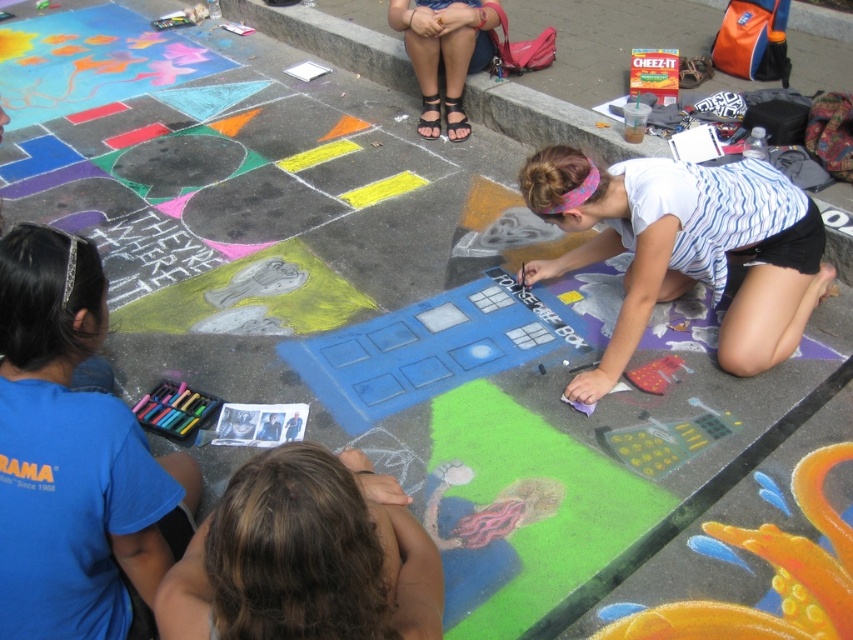
Does blue fabric shirt at lower left have a greater width compared to brown hair at lower left?

Incorrect, blue fabric shirt at lower left's width does not surpass brown hair at lower left's.

Does blue fabric shirt at lower left have a smaller size compared to brown hair at lower left?

No, blue fabric shirt at lower left is not smaller than brown hair at lower left.

Find the location of a particular element. This screenshot has width=853, height=640. blue fabric shirt at lower left is located at coordinates (73, 456).

Can you confirm if blue fabric shirt at lower left is smaller than matte black sandals at upper center?

Indeed, blue fabric shirt at lower left has a smaller size compared to matte black sandals at upper center.

Identify the location of blue fabric shirt at lower left. The height and width of the screenshot is (640, 853). (73, 456).

The width and height of the screenshot is (853, 640). I want to click on blue fabric shirt at lower left, so click(x=73, y=456).

Which is above, white striped shirt at lower right or brown hair at lower left?

white striped shirt at lower right is above.

Is the position of white striped shirt at lower right less distant than that of brown hair at lower left?

No.

Measure the distance between point (625, 300) and camera.

Point (625, 300) and camera are 2.44 meters apart from each other.

Find the location of a particular element. Image resolution: width=853 pixels, height=640 pixels. white striped shirt at lower right is located at coordinates (685, 248).